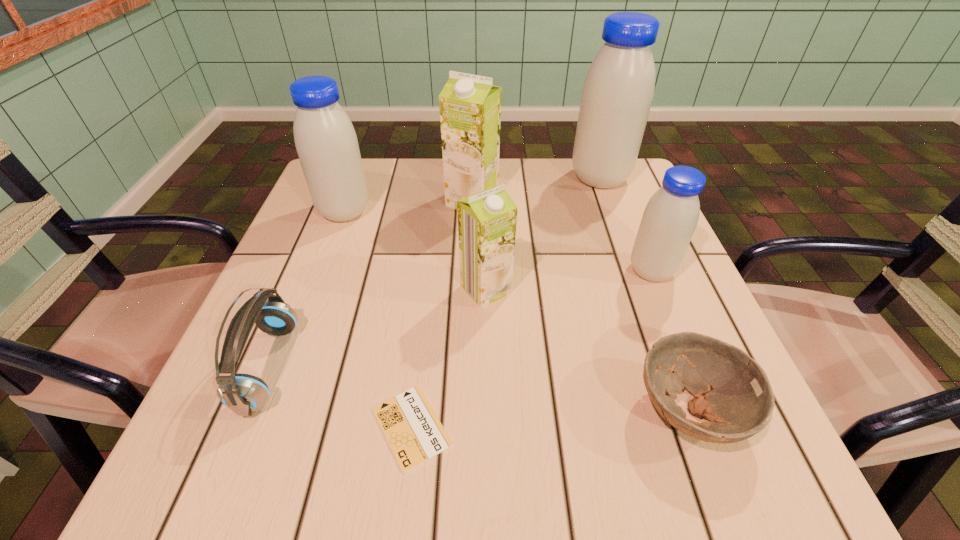
Where is `the biggest blue soya milk`? The height and width of the screenshot is (540, 960). the biggest blue soya milk is located at coordinates (618, 91).

You are a GUI agent. You are given a task and a screenshot of the screen. Output one action in this format:
    pyautogui.click(x=<x>, y=<y>)
    Task: Click on the tallest soya milk
    The height and width of the screenshot is (540, 960).
    Given the screenshot: What is the action you would take?
    pyautogui.click(x=618, y=91)

I want to click on the bigger green soya milk, so click(x=470, y=106).

The height and width of the screenshot is (540, 960). In order to click on the second smallest blue soya milk in this screenshot , I will do `click(327, 146)`.

This screenshot has width=960, height=540. Identify the location of the leftmost blue soya milk. (327, 146).

Find the location of `the nearer green soya milk`. the nearer green soya milk is located at coordinates (487, 220).

At what (x,y) coordinates should I click in order to perform the action: click on the nearest blue soya milk. Please return your answer as a coordinate pair (x, y). Looking at the image, I should click on (669, 220).

The width and height of the screenshot is (960, 540). In order to click on headset in this screenshot , I will do `click(244, 394)`.

Locate an element on the screen. The height and width of the screenshot is (540, 960). blue headset is located at coordinates (244, 394).

Where is `the second shortest object`? This screenshot has width=960, height=540. the second shortest object is located at coordinates (732, 391).